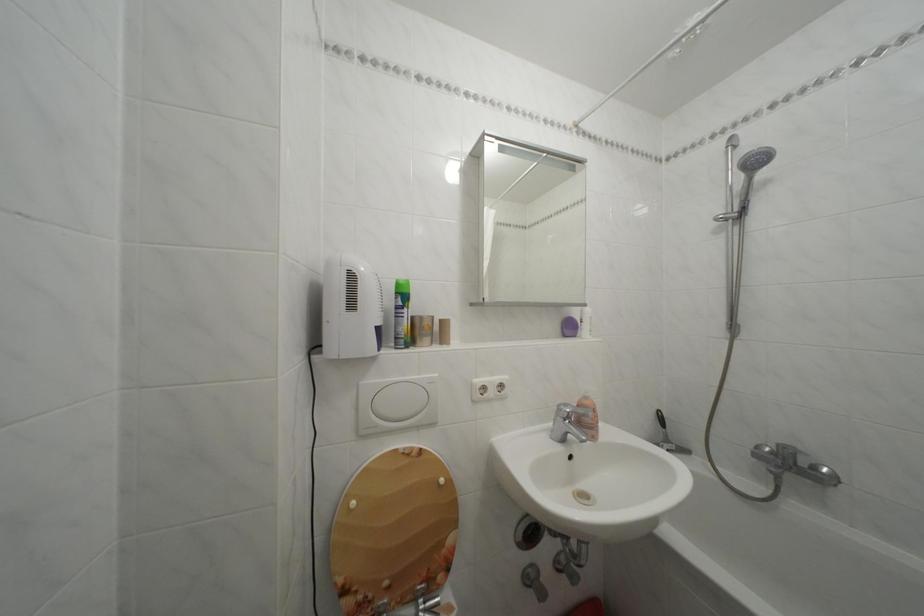
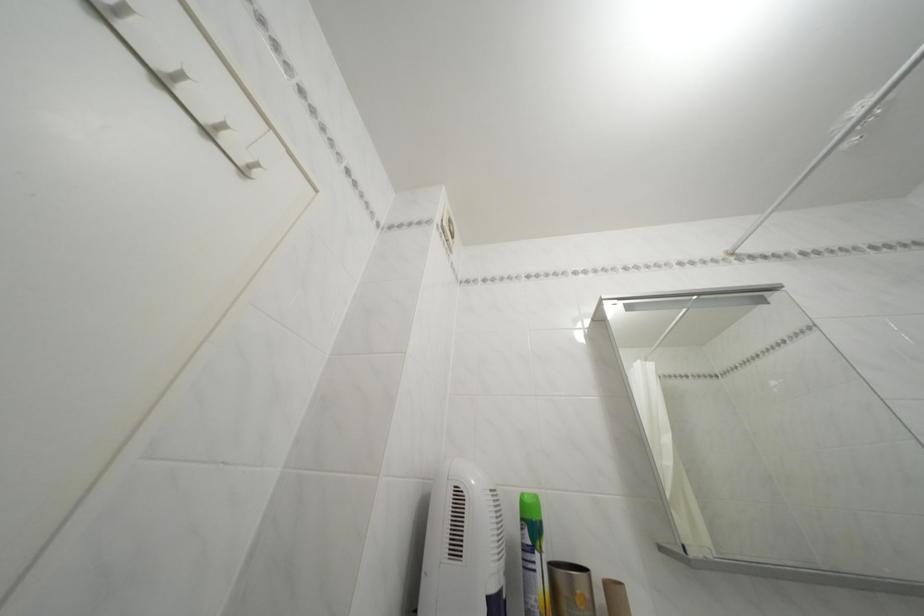
Locate, in the second image, the point that corresponds to [415,315] in the first image.

(545, 562)